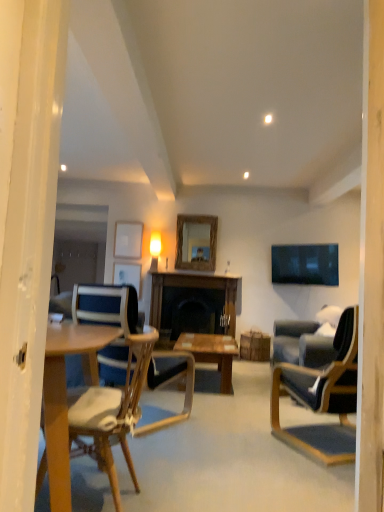
Question: Is rustic wood mirror at center outside wooden/matte coffee table at center?

Choices:
 (A) yes
 (B) no

Answer: (A)

Question: Is rustic wood mirror at center positioned behind wooden/matte coffee table at center?

Choices:
 (A) no
 (B) yes

Answer: (B)

Question: Is rustic wood mirror at center taller than wooden/matte coffee table at center?

Choices:
 (A) yes
 (B) no

Answer: (A)

Question: From the image's perspective, is rustic wood mirror at center beneath wooden/matte coffee table at center?

Choices:
 (A) no
 (B) yes

Answer: (A)

Question: Considering the relative positions of rustic wood mirror at center and wooden/matte coffee table at center in the image provided, is rustic wood mirror at center to the right of wooden/matte coffee table at center from the viewer's perspective?

Choices:
 (A) yes
 (B) no

Answer: (B)

Question: Can wooden/matte coffee table at center be found inside rustic wood mirror at center?

Choices:
 (A) no
 (B) yes

Answer: (A)

Question: Considering the relative sizes of wooden chair at center, the second chair in the right-to-left sequence, and wooden table at center in the image provided, is wooden chair at center, the second chair in the right-to-left sequence, smaller than wooden table at center?

Choices:
 (A) no
 (B) yes

Answer: (A)

Question: From the image's perspective, would you say wooden chair at center, the second chair in the right-to-left sequence, is shown under wooden table at center?

Choices:
 (A) yes
 (B) no

Answer: (B)

Question: Is wooden chair at center, which ranks as the first chair in left-to-right order, touching wooden table at center?

Choices:
 (A) yes
 (B) no

Answer: (B)

Question: From the image's perspective, is wooden chair at center, the second chair in the right-to-left sequence, on wooden table at center?

Choices:
 (A) yes
 (B) no

Answer: (A)

Question: Is wooden chair at center, which ranks as the first chair in left-to-right order, at the left side of wooden table at center?

Choices:
 (A) yes
 (B) no

Answer: (A)

Question: From a real-world perspective, is wooden chair at center, the second chair in the right-to-left sequence, positioned over wooden table at center based on gravity?

Choices:
 (A) yes
 (B) no

Answer: (B)

Question: Is wooden chair at center, which ranks as the first chair in left-to-right order, wider than rustic wood mirror at center?

Choices:
 (A) no
 (B) yes

Answer: (B)